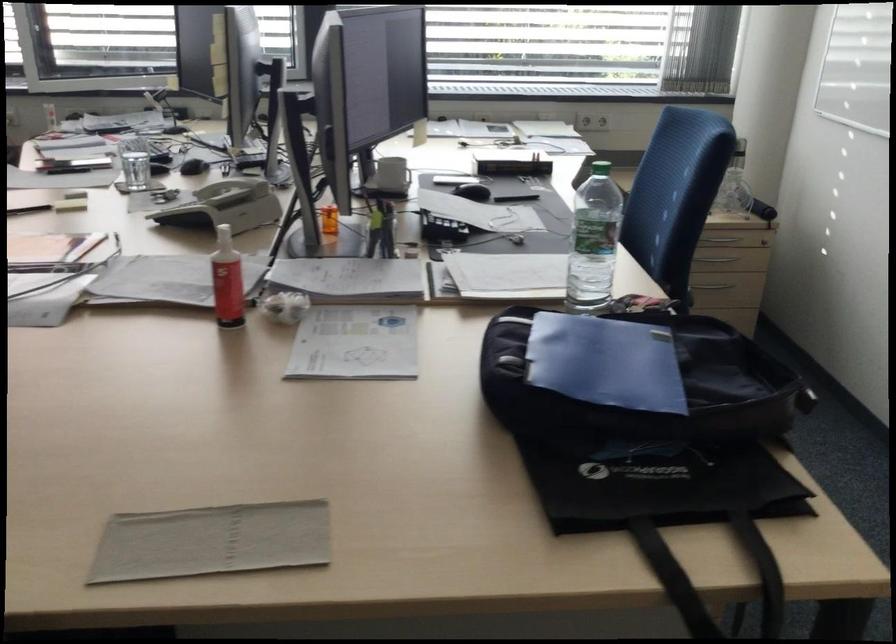
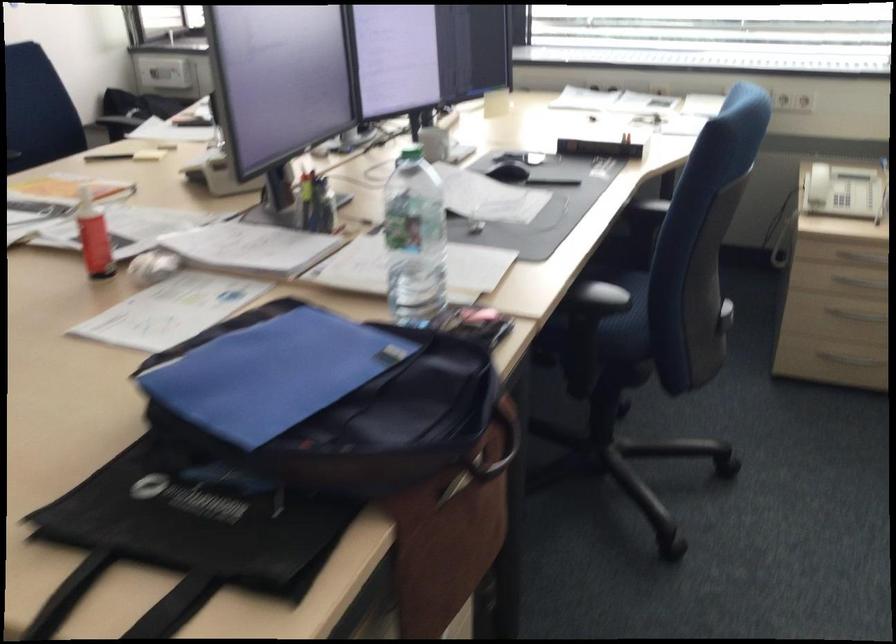
Where in the second image is the point corresponding to [616,360] from the first image?

(271, 374)